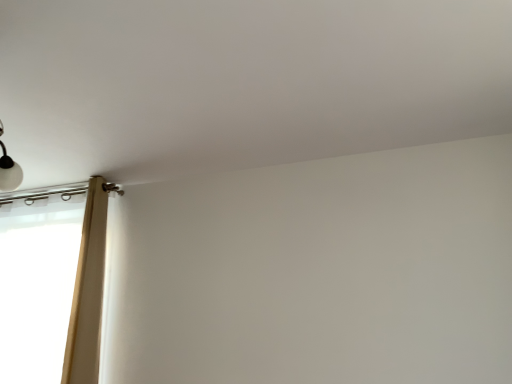
The height and width of the screenshot is (384, 512). Describe the element at coordinates (52, 282) in the screenshot. I see `beige fabric curtain at left` at that location.

The width and height of the screenshot is (512, 384). Find the location of `beige fabric curtain at left`. beige fabric curtain at left is located at coordinates (52, 282).

At what (x,y) coordinates should I click in order to perform the action: click on beige fabric curtain at left. Please return your answer as a coordinate pair (x, y). Looking at the image, I should click on (52, 282).